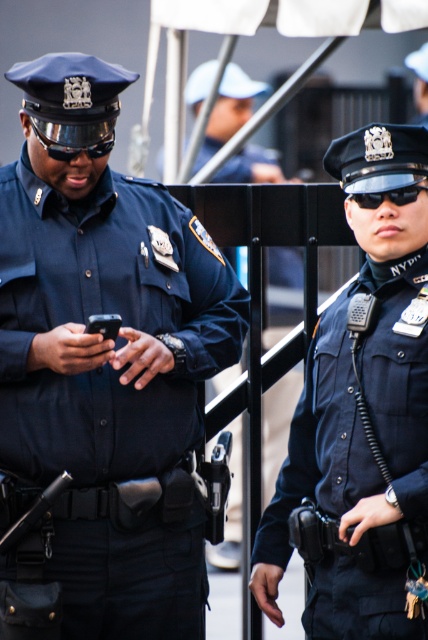
In the scene shown: You are a police officer trying to locate your partner who is wearing a matte blue uniform at left. You see a point at coordinates [106,310] in the image. Is this point likely to be on your partner?

Yes, the point at coordinates [106,310] corresponds to the matte blue uniform at left, so it is likely on your partner.

Based on the scene described, which officer is positioned lower in the image, the one in the matte blue uniform at left or the navy blue uniform at center?

The matte blue uniform at left is positioned below the navy blue uniform at center in the image.

Looking at this image, you are a police recruit observing two officers in the scene. You notice the navy blue uniform at center and the black plastic goggles at center. Which object is taller?

The navy blue uniform at center is taller than the black plastic goggles at center.